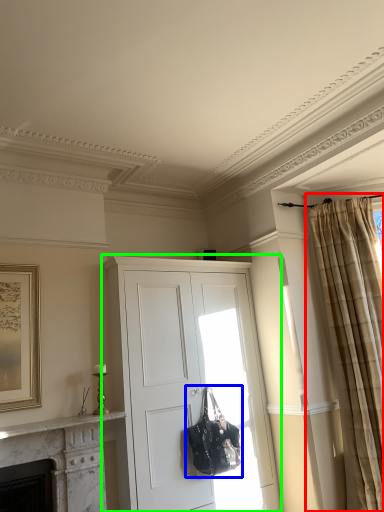
Question: Which is farther away from curtain (highlighted by a red box)? handbag (highlighted by a blue box) or cabinetry (highlighted by a green box)?

Choices:
 (A) handbag
 (B) cabinetry

Answer: (A)